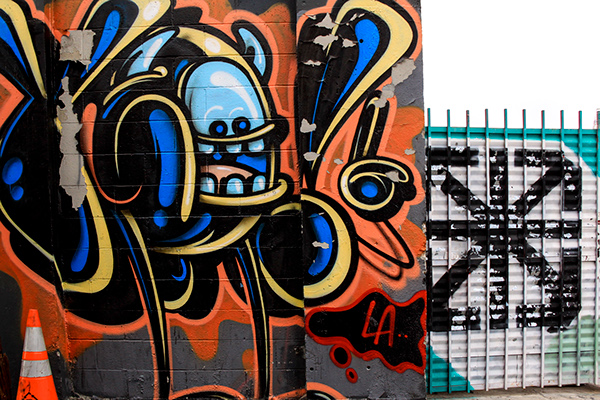
Where is `wall`? The image size is (600, 400). wall is located at coordinates (345, 378).